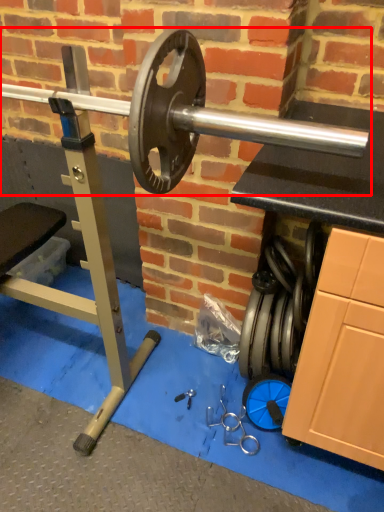
Question: From the image's perspective, where is barbell (annotated by the red box) located relative to tool?

Choices:
 (A) above
 (B) below

Answer: (A)